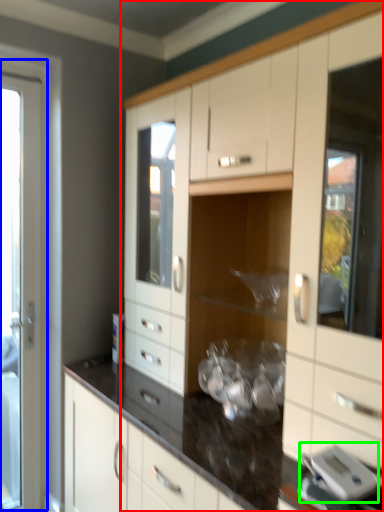
Question: Which object is positioned farthest from cabinetry (highlighted by a red box)? Select from screen door (highlighted by a blue box) and appliance (highlighted by a green box).

Choices:
 (A) screen door
 (B) appliance

Answer: (A)